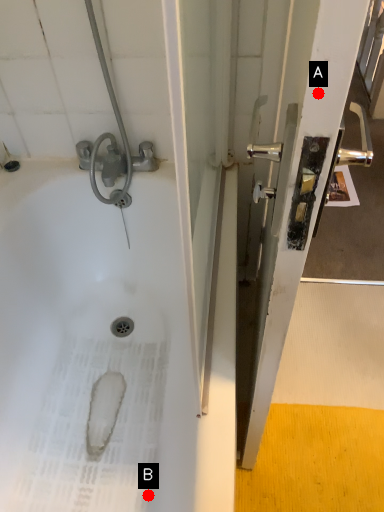
Question: Two points are circled on the image, labeled by A and B beside each circle. Which of the following is the farthest from the observer?

Choices:
 (A) A is further
 (B) B is further

Answer: (B)